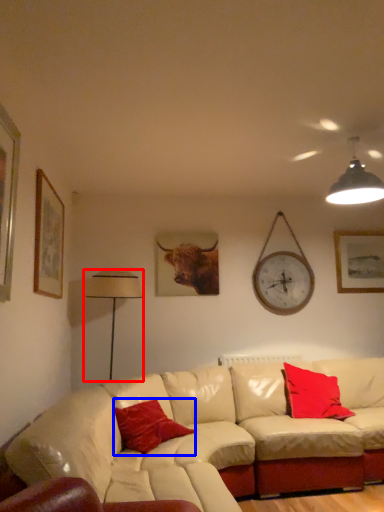
Question: Which of the following is the closest to the observer, table lamp (highlighted by a red box) or pillow (highlighted by a blue box)?

Choices:
 (A) table lamp
 (B) pillow

Answer: (B)